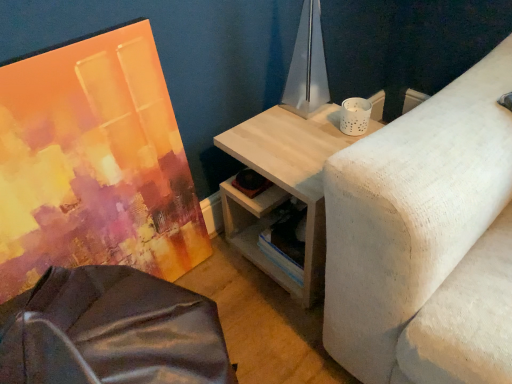
Find the location of a particular element. Image resolution: width=512 pixels, height=384 pixels. metallic silver table lamp at upper center is located at coordinates (307, 66).

This screenshot has height=384, width=512. Describe the element at coordinates (283, 186) in the screenshot. I see `light wood/texture side table at upper right` at that location.

At what (x,y) coordinates should I click in order to perform the action: click on light wood/texture side table at upper right. Please return your answer as a coordinate pair (x, y). This screenshot has width=512, height=384. Looking at the image, I should click on (283, 186).

In order to click on matte acrylic painting at left in this screenshot , I will do `click(93, 162)`.

Where is `metallic silver table lamp at upper center`? The height and width of the screenshot is (384, 512). metallic silver table lamp at upper center is located at coordinates (307, 66).

Considering the relative sizes of metallic silver table lamp at upper center and matte acrylic painting at left in the image provided, is metallic silver table lamp at upper center taller than matte acrylic painting at left?

No.

Is metallic silver table lamp at upper center directly adjacent to matte acrylic painting at left?

No, metallic silver table lamp at upper center is not with matte acrylic painting at left.

Considering the relative sizes of metallic silver table lamp at upper center and matte acrylic painting at left in the image provided, is metallic silver table lamp at upper center thinner than matte acrylic painting at left?

In fact, metallic silver table lamp at upper center might be wider than matte acrylic painting at left.

From the image's perspective, is metallic silver table lamp at upper center above or below matte acrylic painting at left?

Based on their image positions, metallic silver table lamp at upper center is located above matte acrylic painting at left.

In the scene shown: Is matte acrylic painting at left outside of light wood/texture side table at upper right?

Yes, matte acrylic painting at left is outside of light wood/texture side table at upper right.

In the scene shown: Which is closer, [97,103] or [349,144]?

Point [97,103] appears to be closer to the viewer than point [349,144].

This screenshot has width=512, height=384. Identify the location of table lamp on the right of the matte acrylic painting at left. (307, 66).

Considering the relative sizes of matte acrylic painting at left and metallic silver table lamp at upper center in the image provided, is matte acrylic painting at left smaller than metallic silver table lamp at upper center?

No.

From the image's perspective, is matte acrylic painting at left positioned above or below metallic silver table lamp at upper center?

Based on their image positions, matte acrylic painting at left is located beneath metallic silver table lamp at upper center.

How many degrees apart are the facing directions of matte acrylic painting at left and metallic silver table lamp at upper center?

The angular difference between matte acrylic painting at left and metallic silver table lamp at upper center is 90.6 degrees.

From the image's perspective, which is below, metallic silver table lamp at upper center or light wood/texture side table at upper right?

light wood/texture side table at upper right appears lower in the image.

Is point (288, 96) closer to viewer compared to point (331, 144)?

No, it is behind (331, 144).

Looking at this image, between metallic silver table lamp at upper center and light wood/texture side table at upper right, which one has larger size?

Bigger between the two is light wood/texture side table at upper right.

Is light wood/texture side table at upper right looking in the opposite direction of metallic silver table lamp at upper center?

light wood/texture side table at upper right does not have its back to metallic silver table lamp at upper center.

Is light wood/texture side table at upper right thinner than metallic silver table lamp at upper center?

In fact, light wood/texture side table at upper right might be wider than metallic silver table lamp at upper center.

Between point (281, 197) and point (310, 105), which one is positioned in front?

The point (281, 197) is closer.

From a real-world perspective, is light wood/texture side table at upper right over metallic silver table lamp at upper center?

No, from a real-world perspective, light wood/texture side table at upper right is not on top of metallic silver table lamp at upper center.

Would you say light wood/texture side table at upper right contains matte acrylic painting at left?

No, matte acrylic painting at left is not a part of light wood/texture side table at upper right.

Considering the sizes of objects light wood/texture side table at upper right and matte acrylic painting at left in the image provided, who is shorter, light wood/texture side table at upper right or matte acrylic painting at left?

Standing shorter between the two is light wood/texture side table at upper right.

From the image's perspective, is light wood/texture side table at upper right located above matte acrylic painting at left?

No, from the image's perspective, light wood/texture side table at upper right is not over matte acrylic painting at left.

This screenshot has height=384, width=512. I want to click on canvas in front of the metallic silver table lamp at upper center, so click(93, 162).

In order to click on canvas above the light wood/texture side table at upper right (from a real-world perspective) in this screenshot , I will do `click(93, 162)`.

Which object lies nearer to the anchor point metallic silver table lamp at upper center, light wood/texture side table at upper right or matte acrylic painting at left?

Based on the image, light wood/texture side table at upper right appears to be nearer to metallic silver table lamp at upper center.

Considering their positions, is metallic silver table lamp at upper center positioned closer to matte acrylic painting at left than light wood/texture side table at upper right?

light wood/texture side table at upper right is closer to matte acrylic painting at left.

When comparing their distances from light wood/texture side table at upper right, does metallic silver table lamp at upper center or matte acrylic painting at left seem closer?

metallic silver table lamp at upper center lies closer to light wood/texture side table at upper right than the other object.

Based on their spatial positions, is matte acrylic painting at left or light wood/texture side table at upper right closer to metallic silver table lamp at upper center?

light wood/texture side table at upper right lies closer to metallic silver table lamp at upper center than the other object.

Based on their spatial positions, is light wood/texture side table at upper right or metallic silver table lamp at upper center further from matte acrylic painting at left?

Among the two, metallic silver table lamp at upper center is located further to matte acrylic painting at left.

When comparing their distances from light wood/texture side table at upper right, does matte acrylic painting at left or metallic silver table lamp at upper center seem further?

Among the two, matte acrylic painting at left is located further to light wood/texture side table at upper right.

Identify the location of table lamp between matte acrylic painting at left and light wood/texture side table at upper right from left to right. (307, 66).